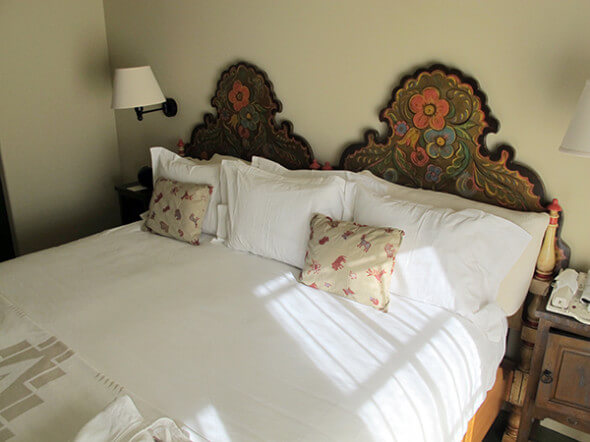
Find the location of a particular element. This screenshot has height=442, width=590. bed posts is located at coordinates (180, 146), (553, 210).